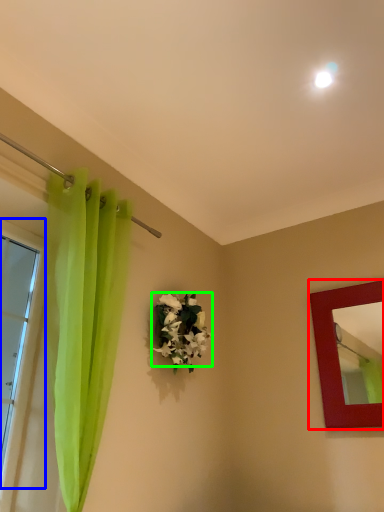
Question: Which object is positioned closest to picture frame (highlighted by a red box)? Select from window (highlighted by a blue box) and flower (highlighted by a green box).

Choices:
 (A) window
 (B) flower

Answer: (B)